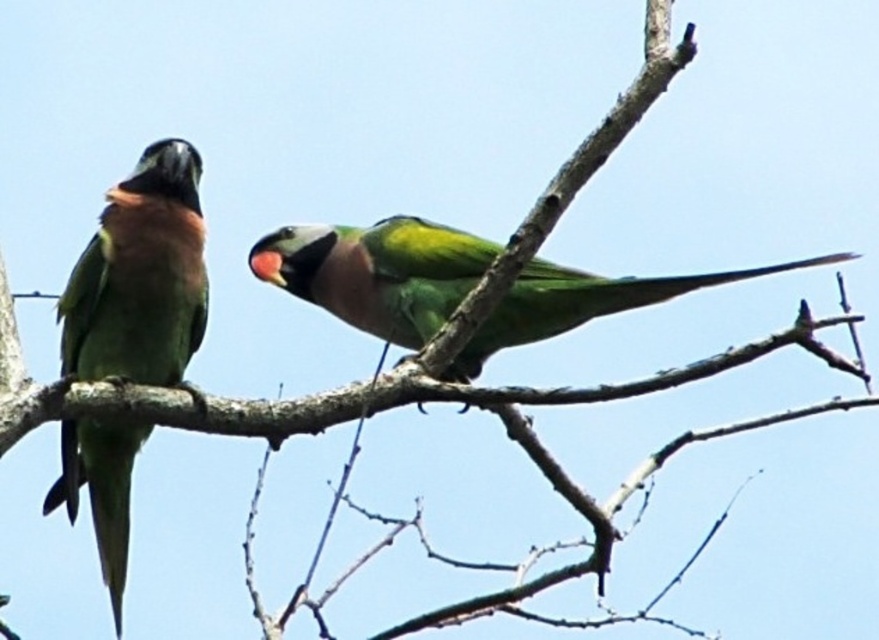
What do you see at coordinates (140, 278) in the screenshot?
I see `green matte parrot at left` at bounding box center [140, 278].

Does green matte parrot at left have a lesser height compared to green matte parrot at center?

No, green matte parrot at left is not shorter than green matte parrot at center.

Does point (118, 381) come behind point (405, 221)?

That is False.

Where is `green matte parrot at left`? green matte parrot at left is located at coordinates (140, 278).